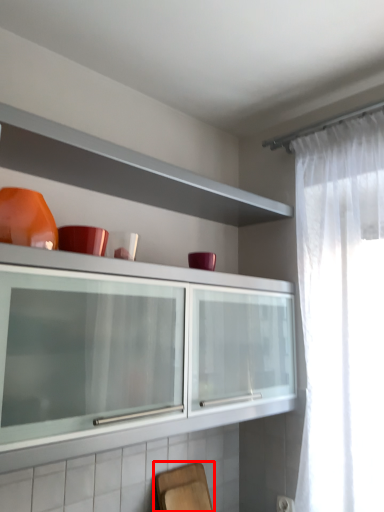
Question: From the image's perspective, considering the relative positions of chair (annotated by the red box) and tableware in the image provided, where is chair (annotated by the red box) located with respect to the staircase?

Choices:
 (A) below
 (B) above

Answer: (A)